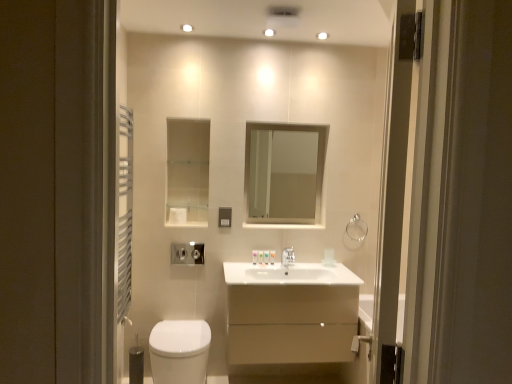
Question: Can you confirm if white glossy sink at center is positioned to the right of translucent plastic soap at center, which ranks as the third toiletry in left-to-right order?

Choices:
 (A) no
 (B) yes

Answer: (B)

Question: Is white glossy sink at center further to camera compared to translucent plastic soap at center, which ranks as the second toiletry in right-to-left order?

Choices:
 (A) yes
 (B) no

Answer: (B)

Question: Does white glossy sink at center lie in front of translucent plastic soap at center, which ranks as the second toiletry in right-to-left order?

Choices:
 (A) no
 (B) yes

Answer: (B)

Question: Does white glossy sink at center have a smaller size compared to translucent plastic soap at center, which ranks as the third toiletry in left-to-right order?

Choices:
 (A) yes
 (B) no

Answer: (B)

Question: Is the surface of white glossy sink at center in direct contact with translucent plastic soap at center, which ranks as the second toiletry in right-to-left order?

Choices:
 (A) yes
 (B) no

Answer: (B)

Question: Considering the positions of point (270, 208) and point (376, 249), is point (270, 208) closer or farther from the camera than point (376, 249)?

Choices:
 (A) closer
 (B) farther

Answer: (B)

Question: From a real-world perspective, relative to transparent glass screen door at right, is clear glass mirror at center vertically above or below?

Choices:
 (A) below
 (B) above

Answer: (B)

Question: Is clear glass mirror at center taller or shorter than transparent glass screen door at right?

Choices:
 (A) tall
 (B) short

Answer: (B)

Question: Based on their sizes in the image, would you say clear glass mirror at center is bigger or smaller than transparent glass screen door at right?

Choices:
 (A) small
 (B) big

Answer: (A)

Question: Is translucent plastic soap at center, the fourth toiletry positioned from the right, to the left or to the right of matte beige cabinet at center in the image?

Choices:
 (A) left
 (B) right

Answer: (A)

Question: Is translucent plastic soap at center, the 1th toiletry when ordered from left to right, inside or outside of matte beige cabinet at center?

Choices:
 (A) inside
 (B) outside

Answer: (B)

Question: In terms of width, does translucent plastic soap at center, the 1th toiletry when ordered from left to right, look wider or thinner when compared to matte beige cabinet at center?

Choices:
 (A) thin
 (B) wide

Answer: (A)

Question: From the image's perspective, is translucent plastic soap at center, the fourth toiletry positioned from the right, above or below matte beige cabinet at center?

Choices:
 (A) above
 (B) below

Answer: (A)

Question: Is white glossy toiletries at center, which ranks as the fourth toiletry in left-to-right order, spatially inside white glossy sink at center, or outside of it?

Choices:
 (A) outside
 (B) inside

Answer: (A)

Question: Is white glossy toiletries at center, which ranks as the fourth toiletry in left-to-right order, taller or shorter than white glossy sink at center?

Choices:
 (A) tall
 (B) short

Answer: (B)